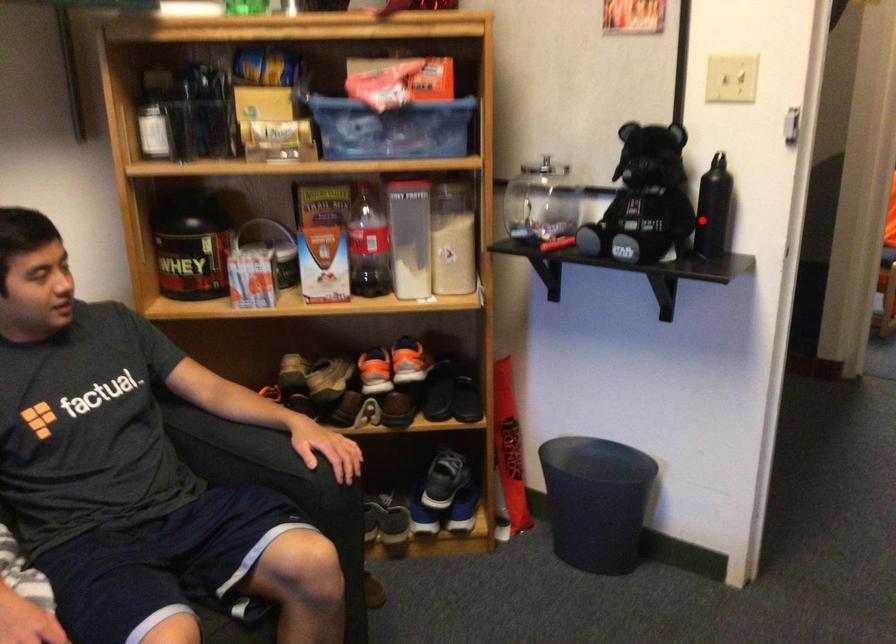
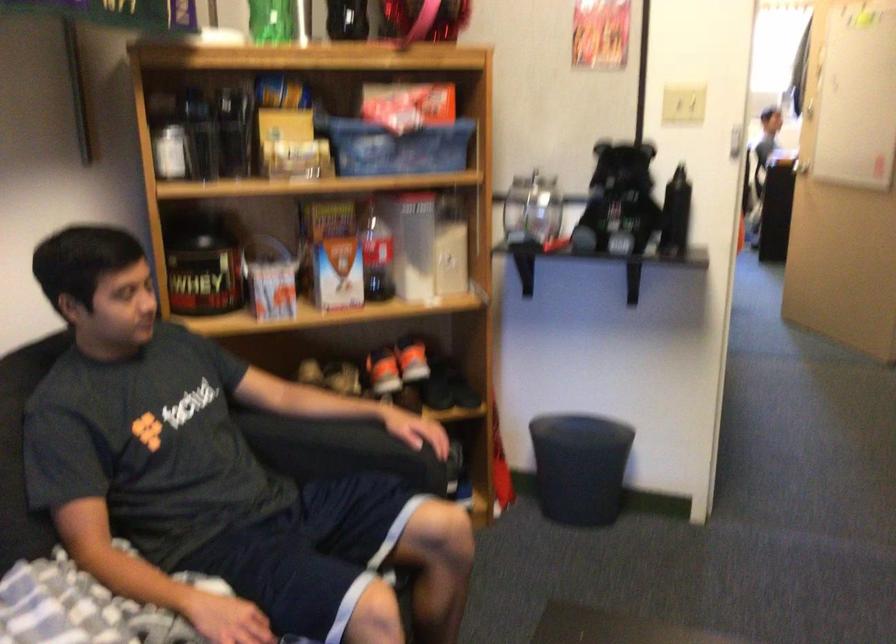
Where in the second image is the point corresponding to the highlighted location from the first image?

(675, 214)